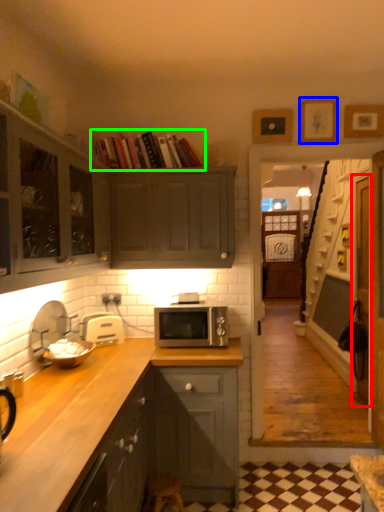
Question: Which is farther away from glass door (highlighted by a red box)? picture frame (highlighted by a blue box) or book (highlighted by a green box)?

Choices:
 (A) picture frame
 (B) book

Answer: (B)